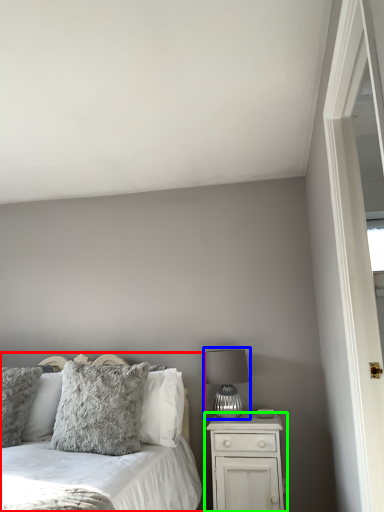
Question: Considering the real-world distances, which object is closest to bed (highlighted by a red box)? table lamp (highlighted by a blue box) or nightstand (highlighted by a green box).

Choices:
 (A) table lamp
 (B) nightstand

Answer: (B)